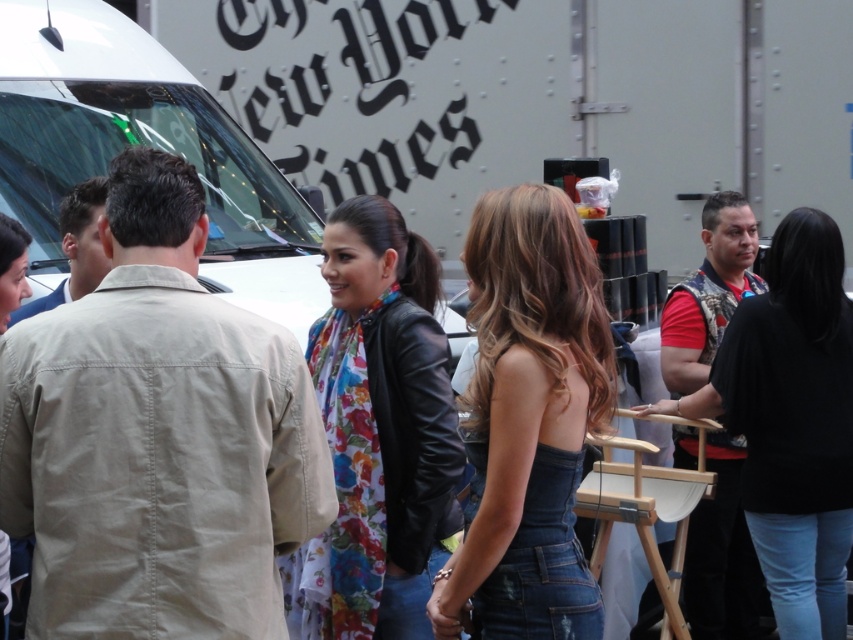
You are at an event and want to take a photo of both the floral fabric scarf at center and the floral scarf at center. Can you fit both in your camera frame if your camera has a 4 feet wide field of view?

The floral fabric scarf at center and floral scarf at center are 3.86 feet apart from each other. Since the distance between them is less than 4 feet, both can be captured in the camera frame.

You are organizing a photo shoot and need to ensure that the floral fabric scarf at center and the floral scarf at center are both visible in the final image. Based on their positions, which one is more likely to be obscured by the other?

The floral fabric scarf at center is positioned under the floral scarf at center, so it is more likely to be obscured by the other.